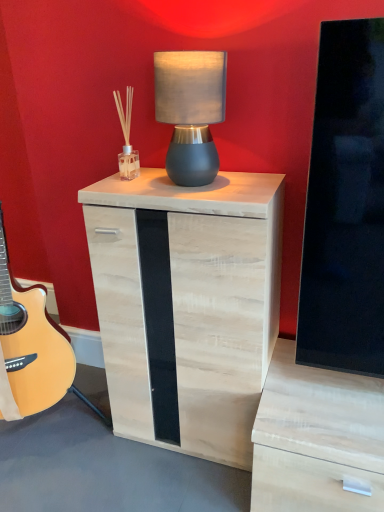
The image size is (384, 512). I want to click on vacant space to the right of matte gray lampshade at center, so click(256, 176).